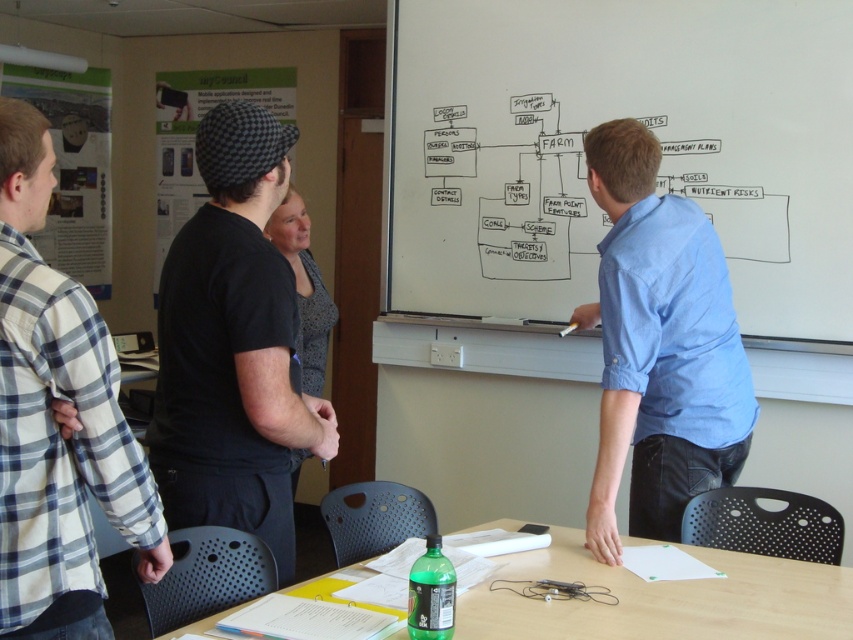
Question: Can you confirm if whiteboard at center is positioned below plaid cotton shirt at left?

Choices:
 (A) yes
 (B) no

Answer: (B)

Question: Which point is closer to the camera?

Choices:
 (A) whiteboard at center
 (B) green plastic bottle at lower center
 (C) plaid cotton shirt at left
 (D) black cotton t-shirt at upper left

Answer: (C)

Question: Is whiteboard at center in front of green plastic bottle at lower center?

Choices:
 (A) yes
 (B) no

Answer: (B)

Question: Which object is closer to the camera taking this photo?

Choices:
 (A) blue cotton shirt at center
 (B) green plastic bottle at lower center
 (C) black cotton t-shirt at upper left

Answer: (B)

Question: Is black cotton t-shirt at upper left below blue cotton shirt at center?

Choices:
 (A) no
 (B) yes

Answer: (B)

Question: Which of the following is the farthest from the observer?

Choices:
 (A) (654, 584)
 (B) (93, 413)
 (C) (636, 326)

Answer: (C)